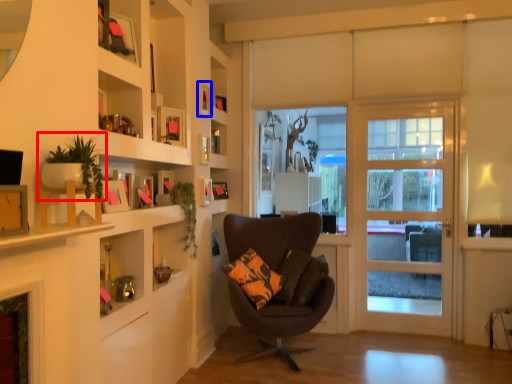
Question: Which object is further to the camera taking this photo, houseplant (highlighted by a red box) or picture frame (highlighted by a blue box)?

Choices:
 (A) houseplant
 (B) picture frame

Answer: (B)